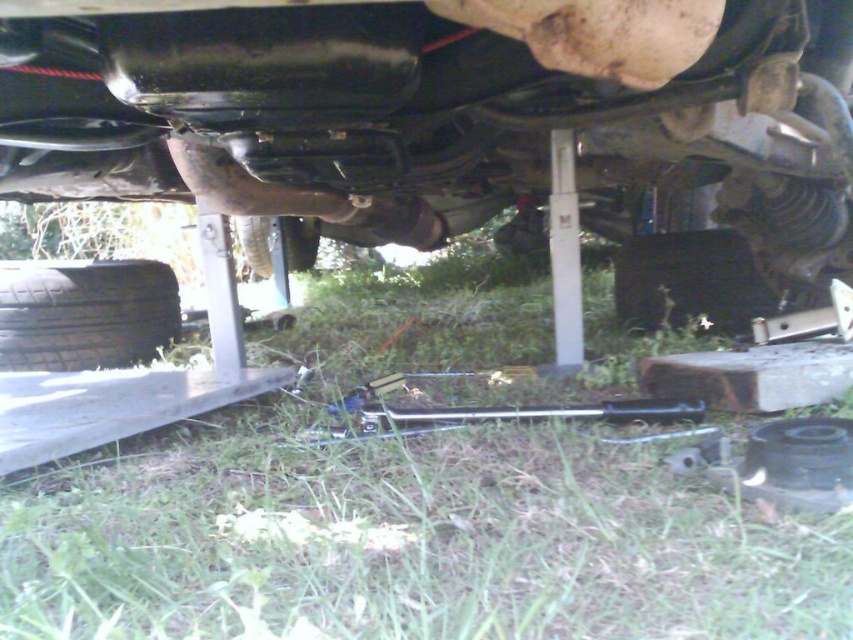
Question: Is black rubber tire at lower left wider than rubber/soft tire at center?

Choices:
 (A) no
 (B) yes

Answer: (B)

Question: Which point appears farthest from the camera in this image?

Choices:
 (A) (42, 356)
 (B) (790, 596)

Answer: (A)

Question: Which point appears closest to the camera in this image?

Choices:
 (A) (143, 276)
 (B) (598, 92)
 (C) (305, 266)

Answer: (B)

Question: Based on their relative distances, which object is farther from the rubber/soft tire at center?

Choices:
 (A) matte black car at center
 (B) green grass at lower center

Answer: (A)

Question: Is matte black car at center positioned at the back of rubber/soft tire at center?

Choices:
 (A) yes
 (B) no

Answer: (B)

Question: Can you confirm if matte black car at center is positioned below rubber/soft tire at center?

Choices:
 (A) no
 (B) yes

Answer: (B)